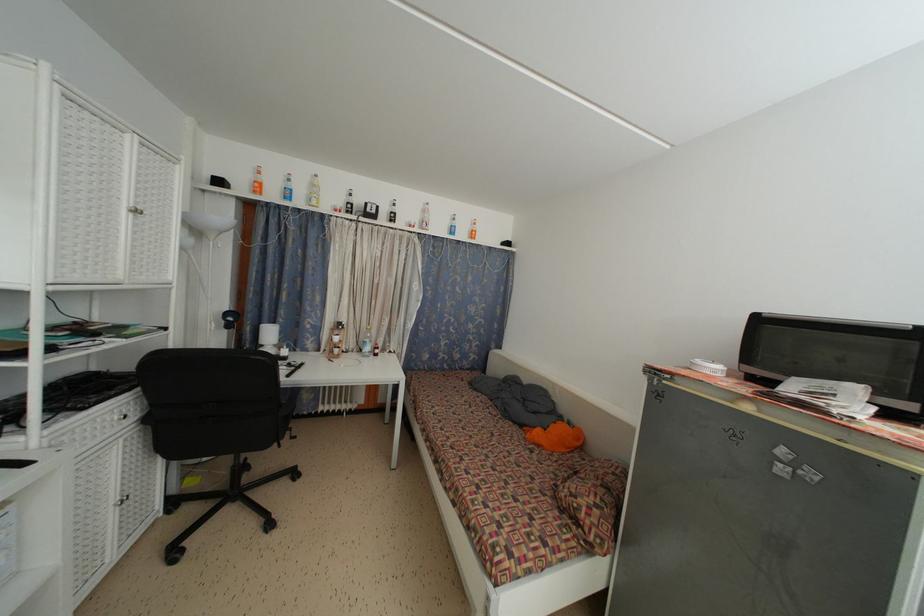
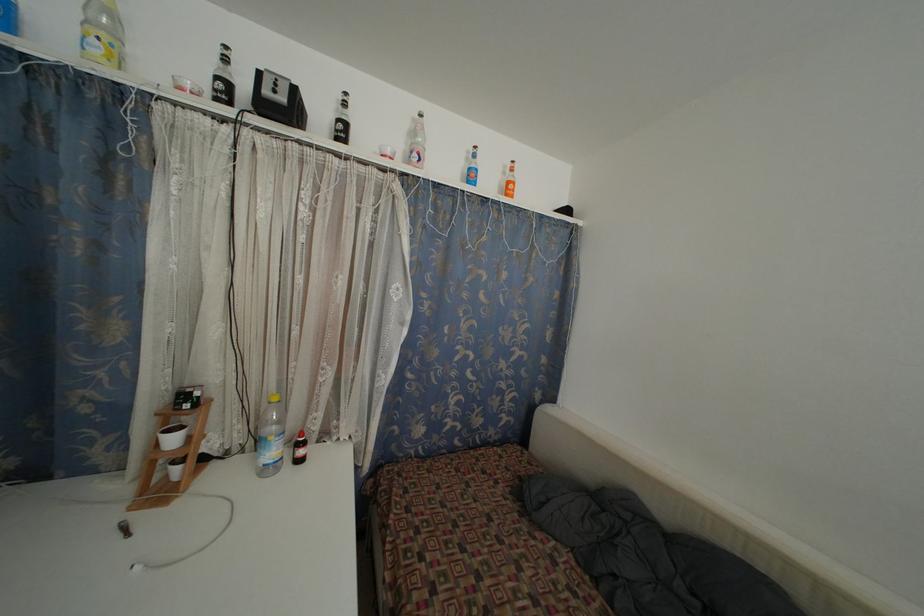
Question: The images are taken continuously from a first-person perspective. In which direction are you moving?

Choices:
 (A) Left
 (B) Right
 (C) Forward
 (D) Backward

Answer: (C)